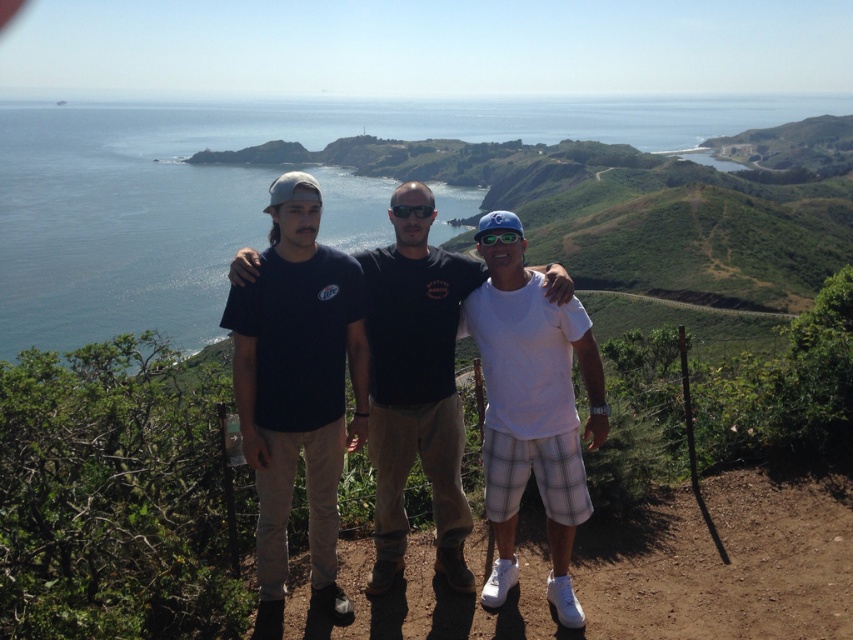
Question: Is black cotton t-shirt at center below white cotton t-shirt at center?

Choices:
 (A) yes
 (B) no

Answer: (B)

Question: Observing the image, what is the correct spatial positioning of dark blue t-shirt at center in reference to white cotton t-shirt at center?

Choices:
 (A) left
 (B) right

Answer: (A)

Question: Among these points, which one is nearest to the camera?

Choices:
 (A) (373, 252)
 (B) (302, 333)
 (C) (490, 291)

Answer: (B)

Question: Which is farther from the dark blue t-shirt at center?

Choices:
 (A) white cotton t-shirt at center
 (B) black cotton t-shirt at center

Answer: (B)

Question: Which object appears farthest from the camera in this image?

Choices:
 (A) black cotton t-shirt at center
 (B) white cotton t-shirt at center

Answer: (A)

Question: Does black cotton t-shirt at center have a larger size compared to white cotton t-shirt at center?

Choices:
 (A) no
 (B) yes

Answer: (B)